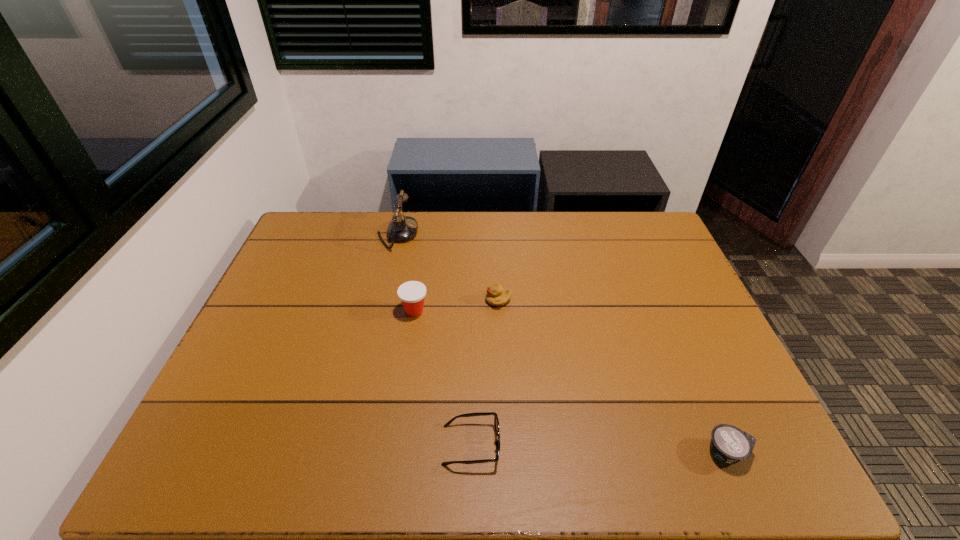
Where is `blank region between the second tallest object and the tallest object`? This screenshot has width=960, height=540. blank region between the second tallest object and the tallest object is located at coordinates (406, 273).

Locate an element on the screen. The width and height of the screenshot is (960, 540). vacant area that lies between the third tallest object and the spectacles is located at coordinates (485, 373).

You are a GUI agent. You are given a task and a screenshot of the screen. Output one action in this format:
    pyautogui.click(x=<x>, y=<y>)
    Task: Click on the vacant space that is in between the rightmost object and the third tallest object
    The image size is (960, 540).
    Given the screenshot: What is the action you would take?
    pyautogui.click(x=612, y=376)

You are a GUI agent. You are given a task and a screenshot of the screen. Output one action in this format:
    pyautogui.click(x=<x>, y=<y>)
    Task: Click on the free area in between the tallest object and the spectacles
    
    Given the screenshot: What is the action you would take?
    pyautogui.click(x=434, y=340)

At what (x,y) coordinates should I click in order to perform the action: click on free area in between the rightmost object and the spectacles. Please return your answer as a coordinate pair (x, y). This screenshot has height=540, width=960. Looking at the image, I should click on (599, 448).

Where is `vacant area that lies between the third shortest object and the Dixie cup`? Image resolution: width=960 pixels, height=540 pixels. vacant area that lies between the third shortest object and the Dixie cup is located at coordinates click(x=456, y=306).

Identify which object is the nearest to the third tallest object. Please provide its 2D coordinates. Your answer should be formatted as a tuple, i.e. [(x, y)], where the tuple contains the x and y coordinates of a point satisfying the conditions above.

[(412, 293)]

Where is `object that stands as the fourth closest to the duckling`? object that stands as the fourth closest to the duckling is located at coordinates (729, 444).

You are a GUI agent. You are given a task and a screenshot of the screen. Output one action in this format:
    pyautogui.click(x=<x>, y=<y>)
    Task: Click on the vacant position in the image that satisfies the following two spatial constraints: 1. on the back side of the rightmost object; 2. on the dial of the farthest object
    This screenshot has height=540, width=960.
    Given the screenshot: What is the action you would take?
    pyautogui.click(x=634, y=234)

This screenshot has width=960, height=540. I want to click on free space that satisfies the following two spatial constraints: 1. on the back side of the rightmost object; 2. on the dial of the farthest object, so click(634, 234).